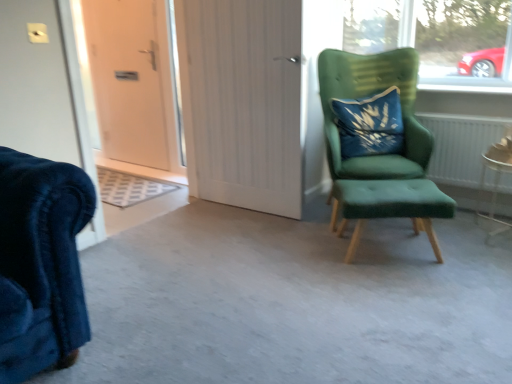
Identify the location of vacant region above white textured radiator at right (from a real-world perspective). (467, 105).